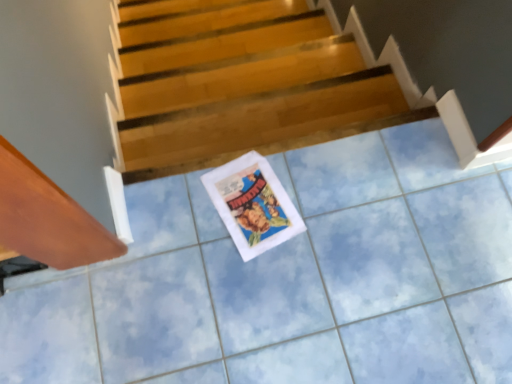
What do you see at coordinates (242, 84) in the screenshot? The image size is (512, 384). I see `wooden stairs at center` at bounding box center [242, 84].

Image resolution: width=512 pixels, height=384 pixels. Identify the location of wooden stairs at center. (242, 84).

In order to face white paper comic book at center, should I rotate leftwards or rightwards?

To align with it, rotate left about 0.331°.

This screenshot has height=384, width=512. What do you see at coordinates (253, 204) in the screenshot?
I see `white paper comic book at center` at bounding box center [253, 204].

Locate an element on the screen. The width and height of the screenshot is (512, 384). white paper comic book at center is located at coordinates (253, 204).

At what (x,y) coordinates should I click in order to perform the action: click on wooden stairs at center. Please return your answer as a coordinate pair (x, y). Image resolution: width=512 pixels, height=384 pixels. Looking at the image, I should click on (242, 84).

Is wooden stairs at center at the left side of white paper comic book at center?

No.

Considering their positions, is wooden stairs at center located in front of or behind white paper comic book at center?

In the image, wooden stairs at center appears behind white paper comic book at center.

Is point (327, 50) in front of point (231, 168)?

No, it is behind (231, 168).

From the image's perspective, is wooden stairs at center above or below white paper comic book at center?

From the image's perspective, wooden stairs at center appears above white paper comic book at center.

From a real-world perspective, is wooden stairs at center physically above white paper comic book at center?

Actually, wooden stairs at center is physically below white paper comic book at center in the real world.

Does wooden stairs at center have a lesser width compared to white paper comic book at center?

Indeed, wooden stairs at center has a lesser width compared to white paper comic book at center.

Which of these two, wooden stairs at center or white paper comic book at center, stands taller?

With more height is wooden stairs at center.

Between wooden stairs at center and white paper comic book at center, which one has larger size?

With larger size is wooden stairs at center.

Consider the image. Is wooden stairs at center not within white paper comic book at center?

wooden stairs at center is positioned outside white paper comic book at center.

Is wooden stairs at center in contact with white paper comic book at center?

wooden stairs at center is not next to white paper comic book at center, and they're not touching.

Could you tell me if wooden stairs at center is facing white paper comic book at center?

No, wooden stairs at center does not turn towards white paper comic book at center.

The height and width of the screenshot is (384, 512). Find the location of `stairs below the white paper comic book at center (from a real-world perspective)`. stairs below the white paper comic book at center (from a real-world perspective) is located at coordinates (242, 84).

Does white paper comic book at center appear on the right side of wooden stairs at center?

No, white paper comic book at center is not to the right of wooden stairs at center.

Does white paper comic book at center come behind wooden stairs at center?

No.

Which is farther, (278, 240) or (281, 39)?

The point (281, 39) is behind.

From the image's perspective, which is below, white paper comic book at center or wooden stairs at center?

white paper comic book at center appears lower in the image.

From a real-world perspective, is white paper comic book at center physically below wooden stairs at center?

No, from a real-world perspective, white paper comic book at center is not beneath wooden stairs at center.

Which object is thinner, white paper comic book at center or wooden stairs at center?

wooden stairs at center.

Does white paper comic book at center have a lesser height compared to wooden stairs at center?

Yes.

Based on the photo, who is smaller, white paper comic book at center or wooden stairs at center?

white paper comic book at center is smaller.

Is white paper comic book at center completely or partially outside of wooden stairs at center?

white paper comic book at center lies outside wooden stairs at center's area.

Is the surface of white paper comic book at center in direct contact with wooden stairs at center?

No, white paper comic book at center is not next to wooden stairs at center.

Is white paper comic book at center aimed at wooden stairs at center?

No, white paper comic book at center is not turned towards wooden stairs at center.

How different are the orientations of white paper comic book at center and wooden stairs at center in degrees?

The angular difference between white paper comic book at center and wooden stairs at center is 14.6 degrees.

Locate an element on the screen. The image size is (512, 384). stairs that is under the white paper comic book at center (from a real-world perspective) is located at coordinates (242, 84).

Find the location of a particular element. comic book lying on the left of wooden stairs at center is located at coordinates (253, 204).

Where is `comic book in front of the wooden stairs at center`? This screenshot has width=512, height=384. comic book in front of the wooden stairs at center is located at coordinates (253, 204).